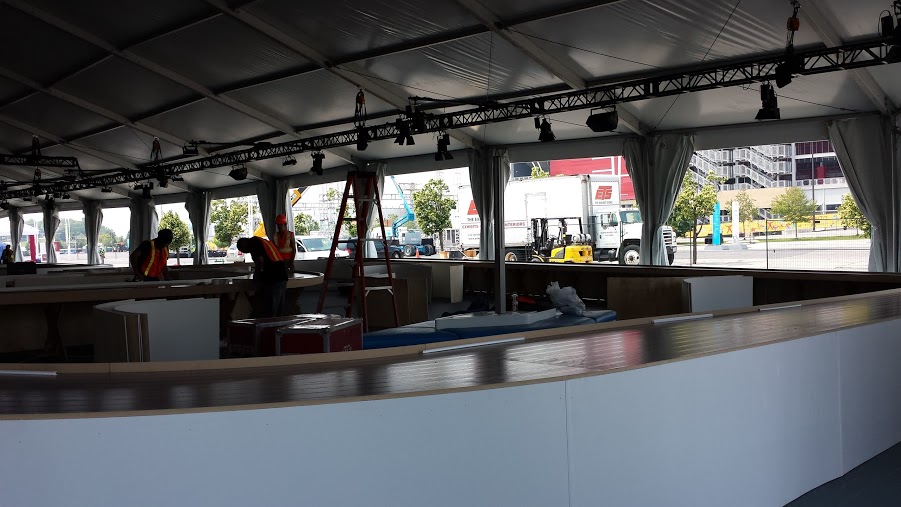
This screenshot has width=901, height=507. I want to click on napkin, so click(547, 295).